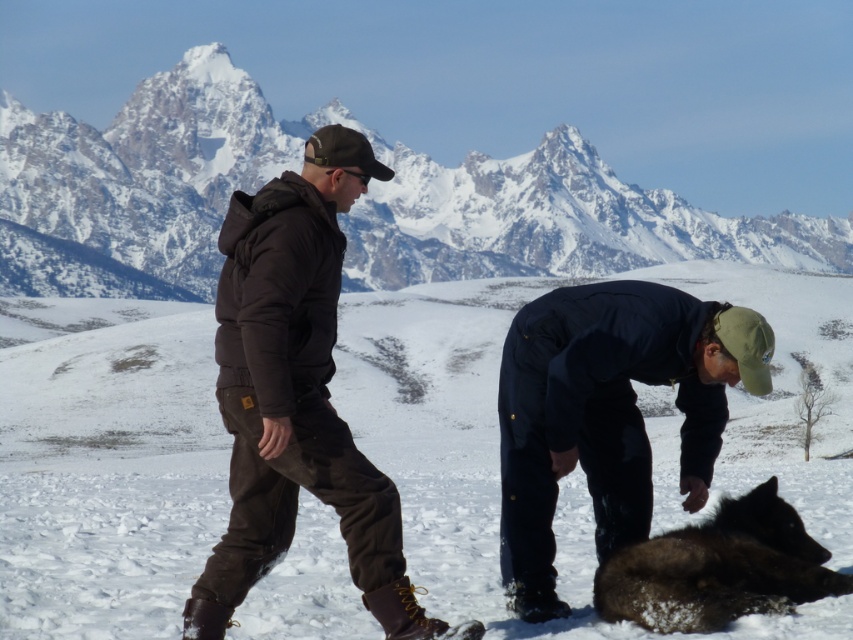
Which is behind, point (426, 301) or point (372, 161)?

Positioned behind is point (426, 301).

Is white fluffy snow at center positioned at the back of matte black jacket at center?

Yes.

Who is more distant from viewer, (50, 632) or (235, 205)?

The point (235, 205) is more distant.

Identify the location of white fluffy snow at center. This screenshot has width=853, height=640. (108, 474).

Between snowy granite mountain at upper center and dark brown fur at lower right, which one is positioned lower?

dark brown fur at lower right is lower down.

The height and width of the screenshot is (640, 853). What do you see at coordinates (347, 216) in the screenshot?
I see `snowy granite mountain at upper center` at bounding box center [347, 216].

Locate an element on the screen. Image resolution: width=853 pixels, height=640 pixels. snowy granite mountain at upper center is located at coordinates (347, 216).

Is white fluffy snow at center to the right of snowy granite mountain at upper center from the viewer's perspective?

Incorrect, white fluffy snow at center is not on the right side of snowy granite mountain at upper center.

From the picture: Is white fluffy snow at center bigger than snowy granite mountain at upper center?

No, white fluffy snow at center is not bigger than snowy granite mountain at upper center.

Which is in front, point (474, 508) or point (184, 184)?

Point (474, 508)

You are a GUI agent. You are given a task and a screenshot of the screen. Output one action in this format:
    pyautogui.click(x=<x>, y=<y>)
    Task: Click on the white fluffy snow at center
    
    Given the screenshot: What is the action you would take?
    pyautogui.click(x=108, y=474)